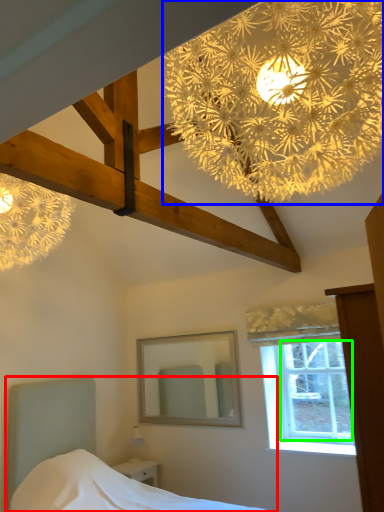
Question: Estimate the real-world distances between objects in this image. Which object is farther from bed (highlighted by a red box), flower (highlighted by a blue box) or window screen (highlighted by a green box)?

Choices:
 (A) flower
 (B) window screen

Answer: (A)